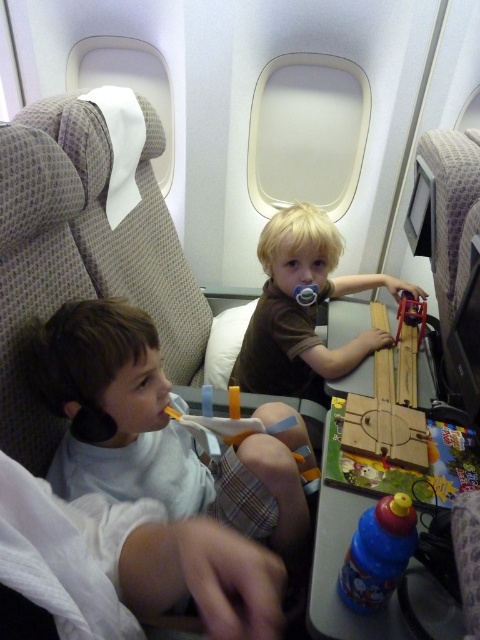
You are a flight attendant checking the safety of the airplane cabin. You notice the brown matte shirt at center and the wooden train at center. Which object is more likely to be a potential safety hazard if it were to fall onto a passenger below?

The brown matte shirt at center is larger in size than the wooden train at center, so it is more likely to be a potential safety hazard if it were to fall onto a passenger below due to its larger size.

You are a flight attendant checking seat assignments. According to the image, where is the brown matte shirt at center positioned relative to the airplane seats?

The brown matte shirt at center is located at point (302, 308) relative to the airplane seats.

You are a flight attendant checking the lavatory for safety equipment. You need to place a white soft toothbrush at left into the lavatory bin which can only hold items less than 36 inches in length. Will the toothbrush fit?

The white soft toothbrush at left is 35.85 inches long, which is under the 36 inch limit, so it will fit in the lavatory bin.